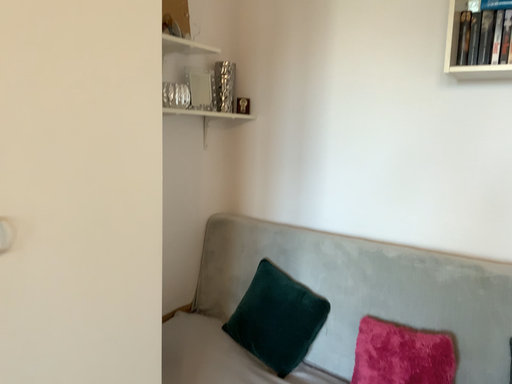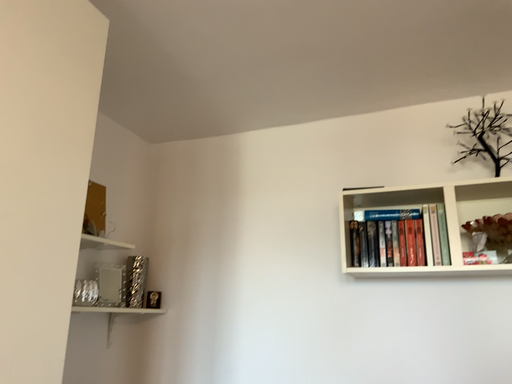
Question: Which way did the camera rotate in the video?

Choices:
 (A) rotated upward
 (B) rotated downward

Answer: (A)